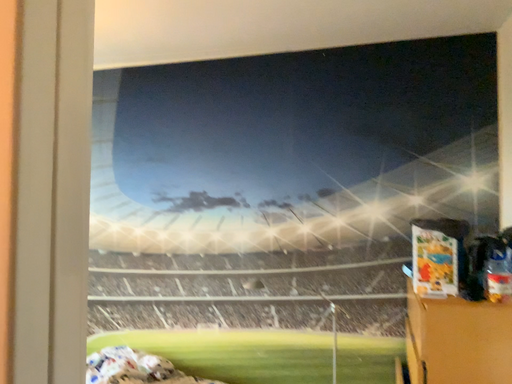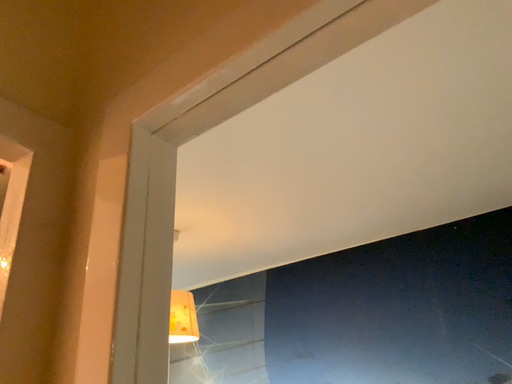
Question: Which way did the camera rotate in the video?

Choices:
 (A) rotated downward
 (B) rotated upward

Answer: (B)